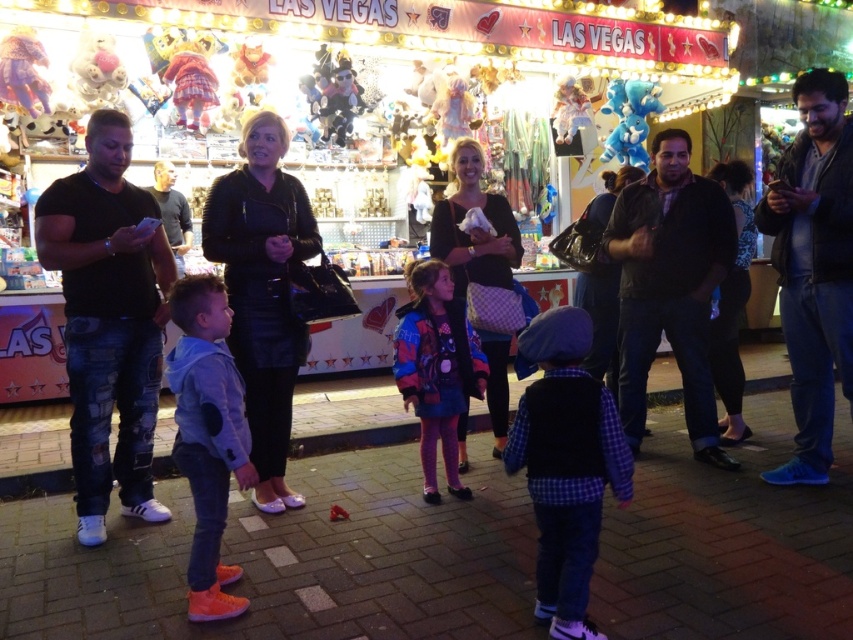
You are a costume designer preparing for a play and need to choose between two outfits displayed at a carnival booth. The outfits are the plaid fabric vest at center and the multicolored fabric jacket at center. Based on their sizes, which one would be more suitable for an actor who needs a wider garment to perform exaggerated movements?

The multicolored fabric jacket at center is wider than the plaid fabric vest at center, making it more suitable for an actor needing a wider garment for exaggerated movements.

You are a tailor who needs to determine which jacket is more suitable for a customer who prefers shorter jackets. Based on the image, which jacket between the light blue denim jacket at center and the multicolored fabric jacket at center would you recommend?

The light blue denim jacket at center is shorter than the multicolored fabric jacket at center, so the light blue denim jacket at center would be more suitable for a customer preferring shorter jackets.

You are standing at the entrance of the carnival game booth. You need to locate the plaid fabric vest at center. According to the coordinates provided, where exactly is it positioned?

The plaid fabric vest at center is located at point coordinates (566, 465).